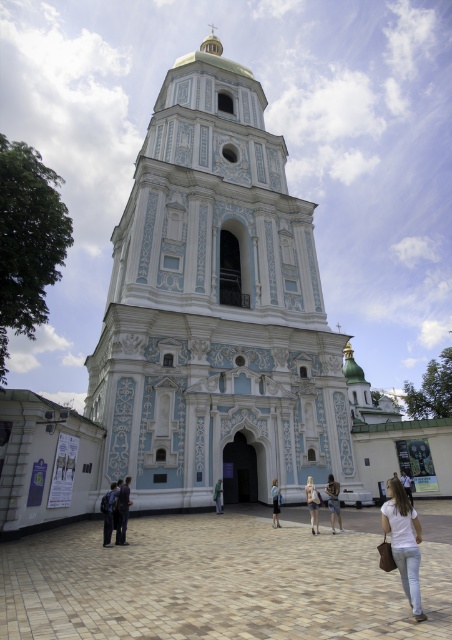
You are standing in front of the grand building and want to take a photo. You notice two points marked on the facade. The first point is at coordinates point (394, 536) and the second at point (207, 44). Which of these points is closer to you?

Point (394, 536) is closer to the viewer than point (207, 44).

You are standing in front of the grand building and want to take a photo that includes both the gold metallic spire at upper center and the green fabric jacket at center. Which object should you adjust your camera angle to focus on first to ensure both are in frame?

The gold metallic spire at upper center is further to the viewer than the green fabric jacket at center, so you should focus on the gold metallic spire at upper center first to ensure both are in frame.